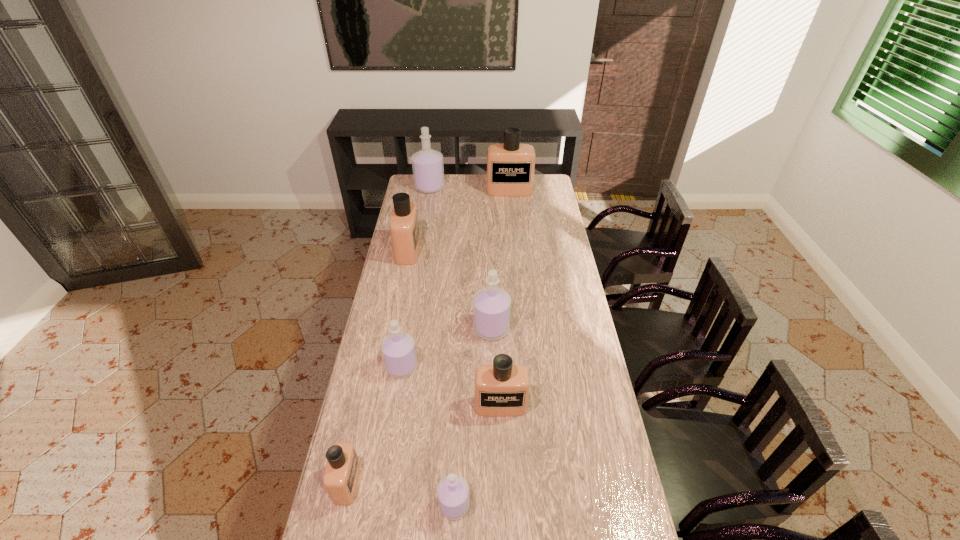
What are the coordinates of `beige perfume that can be found as the second closest to the third farthest beige perfume` in the screenshot? It's located at (404, 227).

The width and height of the screenshot is (960, 540). I want to click on vacant point that satisfies the following two spatial constraints: 1. on the front label of the third biggest beige perfume; 2. on the front label of the nearest beige perfume, so click(504, 483).

Identify the location of free space in the image that satisfies the following two spatial constraints: 1. on the front label of the third nearest perfume; 2. on the front label of the nearest beige perfume. The image size is (960, 540). coord(504,483).

At what (x,y) coordinates should I click in order to perform the action: click on free space that satisfies the following two spatial constraints: 1. on the front label of the fourth object from right to left; 2. on the left side of the sixth nearest object. Please return your answer as a coordinate pair (x, y). The image size is (960, 540). Looking at the image, I should click on (359, 505).

Where is `free space that satisfies the following two spatial constraints: 1. on the front side of the farthest purple perfume; 2. on the left side of the fourth nearest perfume`? free space that satisfies the following two spatial constraints: 1. on the front side of the farthest purple perfume; 2. on the left side of the fourth nearest perfume is located at coordinates (400, 367).

Find the location of a particular element. This screenshot has width=960, height=540. free spot that satisfies the following two spatial constraints: 1. on the front side of the biggest purple perfume; 2. on the left side of the fifth nearest perfume is located at coordinates (407, 328).

The height and width of the screenshot is (540, 960). I want to click on blank area in the image that satisfies the following two spatial constraints: 1. on the front label of the third farthest perfume; 2. on the back side of the nearest purple perfume, so click(359, 505).

Locate an element on the screen. The image size is (960, 540). free point that satisfies the following two spatial constraints: 1. on the front label of the sixth nearest perfume; 2. on the back side of the fourth nearest perfume is located at coordinates (386, 367).

You are a GUI agent. You are given a task and a screenshot of the screen. Output one action in this format:
    pyautogui.click(x=<x>, y=<y>)
    Task: Click on the vacant space that satisfies the following two spatial constraints: 1. on the front label of the farthest beige perfume; 2. on the front label of the nearest beige perfume
    Image resolution: width=960 pixels, height=540 pixels.
    Given the screenshot: What is the action you would take?
    pyautogui.click(x=537, y=483)